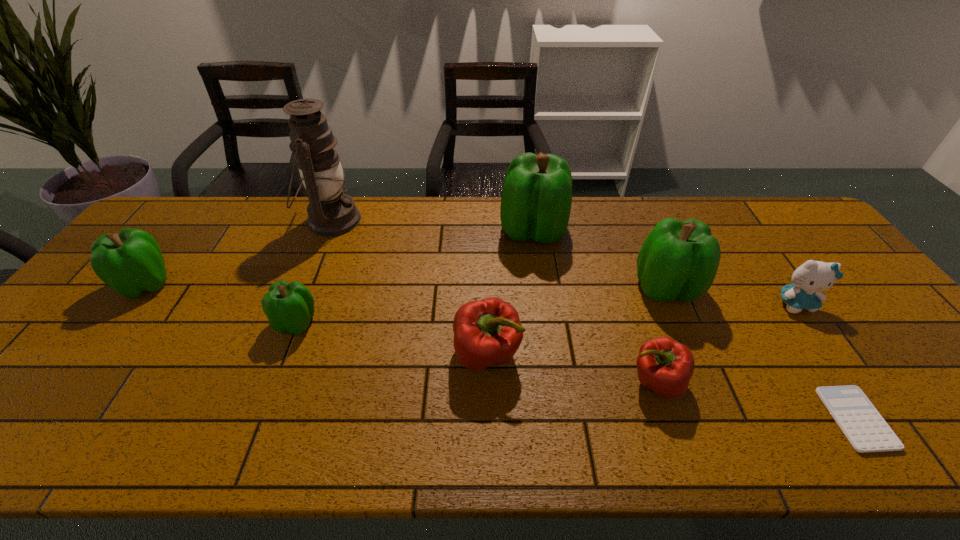
I want to click on vacant area at the left edge, so click(62, 373).

At what (x,y) coordinates should I click in order to perform the action: click on free point between the second biggest green bell pepper and the bigger pink bell pepper. Please return your answer as a coordinate pair (x, y). The width and height of the screenshot is (960, 540). Looking at the image, I should click on (577, 321).

Locate an element on the screen. This screenshot has height=540, width=960. empty space between the left pink bell pepper and the tallest object is located at coordinates (409, 288).

Find the location of a particular element. The image size is (960, 540). free area in between the oil lamp and the third tallest object is located at coordinates (499, 254).

What are the coordinates of `free spot between the kitten and the smallest green bell pepper` in the screenshot? It's located at (546, 313).

Locate an element on the screen. The height and width of the screenshot is (540, 960). free space that is in between the right pink bell pepper and the third tallest object is located at coordinates (661, 335).

You are a GUI agent. You are given a task and a screenshot of the screen. Output one action in this format:
    pyautogui.click(x=<x>, y=<y>)
    Task: Click on the vacant point located between the blue kitten and the left pink bell pepper
    The image size is (960, 540).
    Given the screenshot: What is the action you would take?
    pyautogui.click(x=641, y=329)

Identify the location of vacant area that lies between the third biggest green bell pepper and the left pink bell pepper. This screenshot has height=540, width=960. (317, 320).

Image resolution: width=960 pixels, height=540 pixels. Find the location of `vacant point located between the left pink bell pepper and the leftmost green bell pepper`. vacant point located between the left pink bell pepper and the leftmost green bell pepper is located at coordinates pos(317,320).

This screenshot has width=960, height=540. What are the coordinates of `unoccupied area between the rightmost green bell pepper and the left pink bell pepper` in the screenshot? It's located at (577, 321).